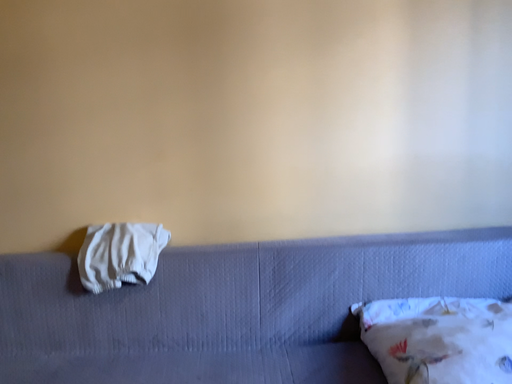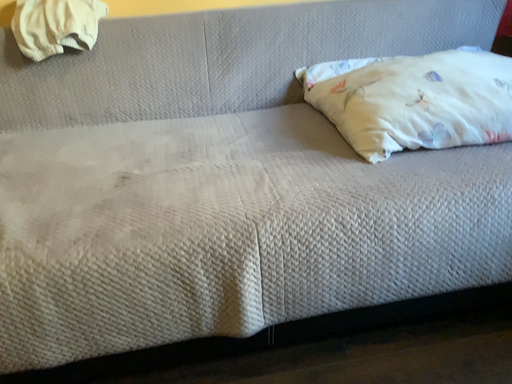
Question: Which way did the camera rotate in the video?

Choices:
 (A) rotated upward
 (B) rotated downward

Answer: (B)